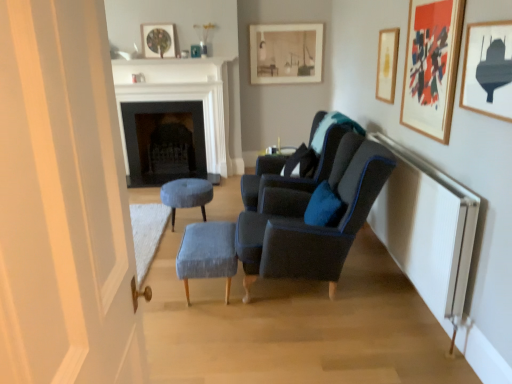
Find the location of a particular element. The image size is (512, 384). free space above velvet grey stool at center, arranged as the second stool when viewed from the front (from a real-world perspective) is located at coordinates (188, 185).